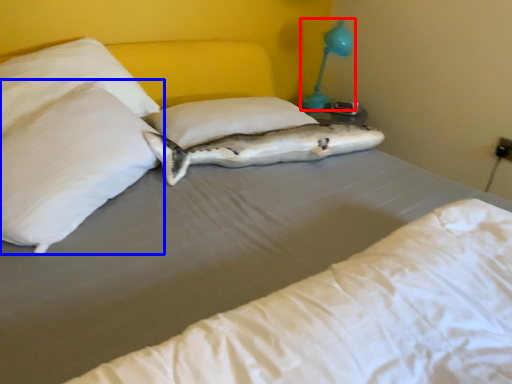
Question: Which point is further to the camera, bedside lamp (highlighted by a red box) or pillow (highlighted by a blue box)?

Choices:
 (A) bedside lamp
 (B) pillow

Answer: (A)